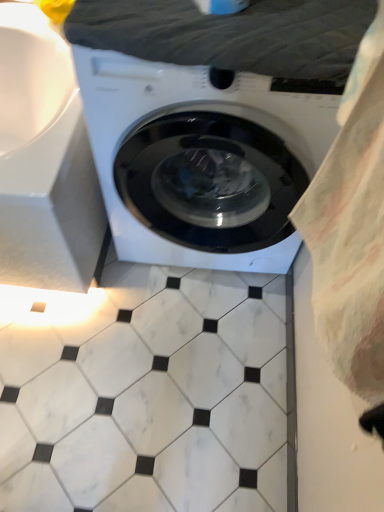
Question: Looking at their shapes, would you say white glossy washing machine at center is wider or thinner than dark gray fabric at upper center?

Choices:
 (A) thin
 (B) wide

Answer: (B)

Question: Based on their sizes in the image, would you say white glossy washing machine at center is bigger or smaller than dark gray fabric at upper center?

Choices:
 (A) small
 (B) big

Answer: (B)

Question: From a real-world perspective, is white glossy washing machine at center positioned above or below dark gray fabric at upper center?

Choices:
 (A) above
 (B) below

Answer: (B)

Question: Based on their positions, is dark gray fabric at upper center located to the left or right of white glossy washing machine at center?

Choices:
 (A) left
 (B) right

Answer: (B)

Question: Is dark gray fabric at upper center in front of or behind white glossy washing machine at center in the image?

Choices:
 (A) front
 (B) behind

Answer: (B)

Question: In terms of width, does dark gray fabric at upper center look wider or thinner when compared to white glossy washing machine at center?

Choices:
 (A) wide
 (B) thin

Answer: (B)

Question: Considering the positions of point (317, 12) and point (196, 98), is point (317, 12) closer or farther from the camera than point (196, 98)?

Choices:
 (A) farther
 (B) closer

Answer: (B)